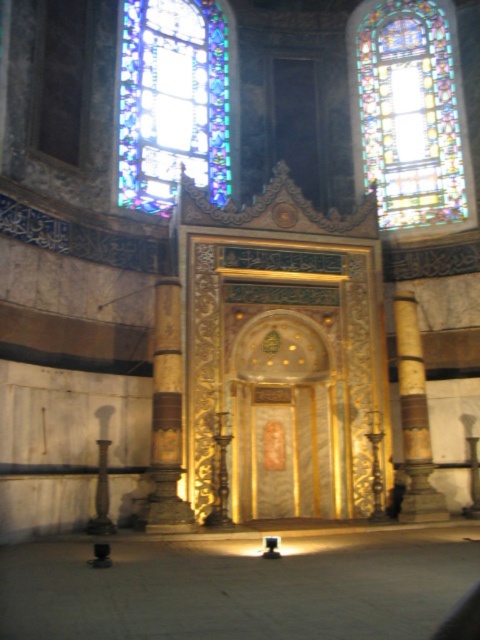
Can you confirm if stained glass window at upper left is shorter than gold-carved column at center?

In fact, stained glass window at upper left may be taller than gold-carved column at center.

Is point (126, 61) more distant than point (155, 298)?

That is True.

Where is `stained glass window at upper left`? The image size is (480, 640). stained glass window at upper left is located at coordinates (172, 100).

Can you confirm if stained glass at upper right is thinner than stained glass window at upper left?

Incorrect, stained glass at upper right's width is not less than stained glass window at upper left's.

Can you confirm if stained glass at upper right is positioned above stained glass window at upper left?

Indeed, stained glass at upper right is positioned over stained glass window at upper left.

The width and height of the screenshot is (480, 640). Describe the element at coordinates (409, 113) in the screenshot. I see `stained glass at upper right` at that location.

Find the location of a particular element. This screenshot has height=640, width=480. stained glass at upper right is located at coordinates (409, 113).

Between stained glass window at upper left and gold polished column at right, which one has more height?

stained glass window at upper left

Is stained glass window at upper left to the right of gold polished column at right from the viewer's perspective?

Incorrect, stained glass window at upper left is not on the right side of gold polished column at right.

Where is `stained glass window at upper left`? stained glass window at upper left is located at coordinates (172, 100).